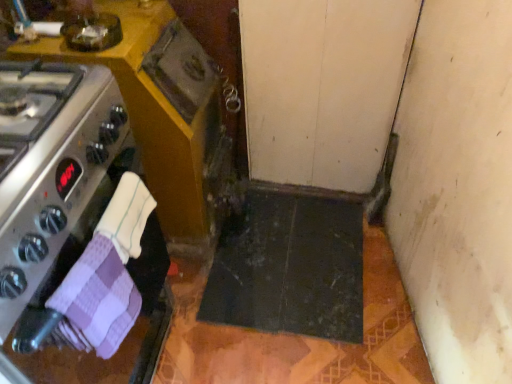
Question: Is purple checkered cloth at left, which ranks as the 1th hand towel in bottom-to-top order, facing away from matte wood cabinet at lower center?

Choices:
 (A) no
 (B) yes

Answer: (A)

Question: Is purple checkered cloth at left, which ranks as the 1th hand towel in bottom-to-top order, located outside matte wood cabinet at lower center?

Choices:
 (A) no
 (B) yes

Answer: (B)

Question: From the image's perspective, is purple checkered cloth at left, which ranks as the 1th hand towel in bottom-to-top order, above matte wood cabinet at lower center?

Choices:
 (A) no
 (B) yes

Answer: (A)

Question: From a real-world perspective, does purple checkered cloth at left, which ranks as the 1th hand towel in bottom-to-top order, sit lower than matte wood cabinet at lower center?

Choices:
 (A) no
 (B) yes

Answer: (A)

Question: Is matte wood cabinet at lower center a part of purple checkered cloth at left, which ranks as the 1th hand towel in bottom-to-top order?

Choices:
 (A) no
 (B) yes

Answer: (A)

Question: In the image, is white textured hand towel at lower left, which appears as the 2th hand towel when ordered from the bottom, positioned in front of or behind satin silver oven at left?

Choices:
 (A) behind
 (B) front

Answer: (A)

Question: Considering the positions of white textured hand towel at lower left, which appears as the 2th hand towel when ordered from the bottom, and satin silver oven at left in the image, is white textured hand towel at lower left, which appears as the 2th hand towel when ordered from the bottom, taller or shorter than satin silver oven at left?

Choices:
 (A) tall
 (B) short

Answer: (B)

Question: Is white textured hand towel at lower left, which appears as the 2th hand towel when ordered from the bottom, situated inside satin silver oven at left or outside?

Choices:
 (A) outside
 (B) inside

Answer: (A)

Question: From a real-world perspective, relative to satin silver oven at left, is white textured hand towel at lower left, the 1th hand towel from the top, vertically above or below?

Choices:
 (A) above
 (B) below

Answer: (B)

Question: Is matte wood cabinet at lower center inside the boundaries of white textured hand towel at lower left, which appears as the 2th hand towel when ordered from the bottom, or outside?

Choices:
 (A) outside
 (B) inside

Answer: (A)

Question: Does point (147, 99) appear closer or farther from the camera than point (136, 238)?

Choices:
 (A) farther
 (B) closer

Answer: (A)

Question: In terms of size, does matte wood cabinet at lower center appear bigger or smaller than white textured hand towel at lower left, the 1th hand towel from the top?

Choices:
 (A) small
 (B) big

Answer: (B)

Question: Visually, is matte wood cabinet at lower center positioned to the left or to the right of white textured hand towel at lower left, the 1th hand towel from the top?

Choices:
 (A) left
 (B) right

Answer: (A)

Question: Looking at their shapes, would you say matte wood cabinet at lower center is wider or thinner than purple checkered cloth at left, arranged as the 2th hand towel when viewed from the top?

Choices:
 (A) thin
 (B) wide

Answer: (B)

Question: From their relative heights in the image, would you say matte wood cabinet at lower center is taller or shorter than purple checkered cloth at left, which ranks as the 1th hand towel in bottom-to-top order?

Choices:
 (A) tall
 (B) short

Answer: (A)